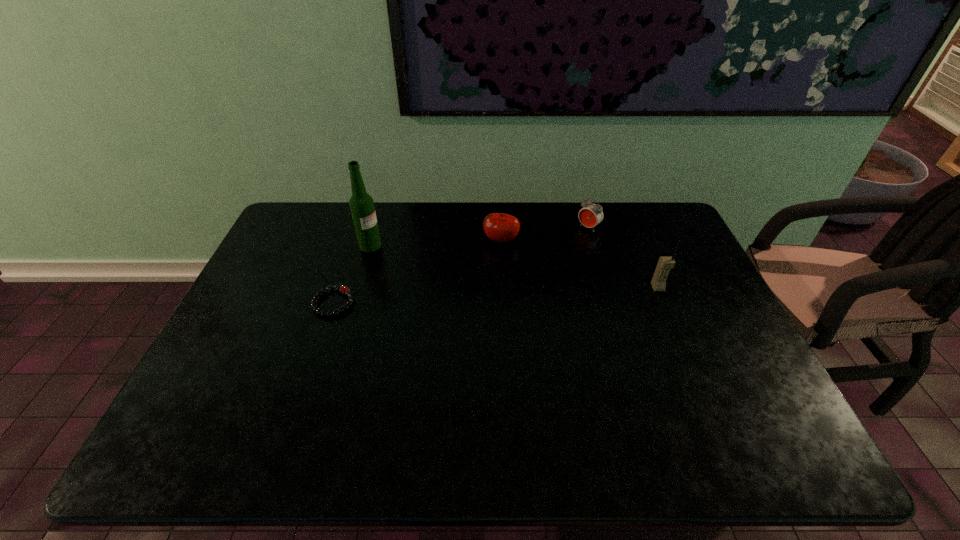
Find the location of `free space on the desktop that is between the bracelet and the cellular telephone and is positioned on the face of the alarm clock`. free space on the desktop that is between the bracelet and the cellular telephone and is positioned on the face of the alarm clock is located at coordinates (510, 295).

Locate an element on the screen. free space on the desktop that is between the bracelet and the fourth shortest object and is positioned on the stem of the apple is located at coordinates (475, 296).

Where is `vacant spot on the desktop that is between the shortest object and the cellular telephone and is positioned on the label of the beer bottle`? vacant spot on the desktop that is between the shortest object and the cellular telephone and is positioned on the label of the beer bottle is located at coordinates (466, 296).